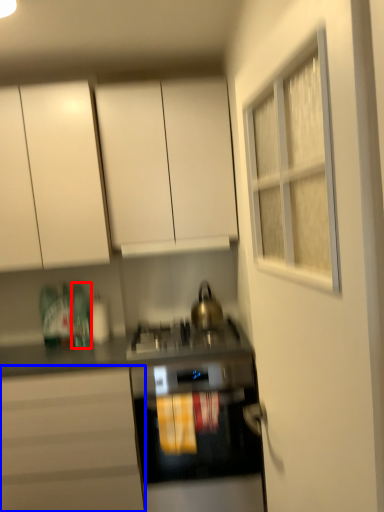
Question: Which of the following is the closest to the observer, bottle (highlighted by a red box) or cabinetry (highlighted by a blue box)?

Choices:
 (A) bottle
 (B) cabinetry

Answer: (B)